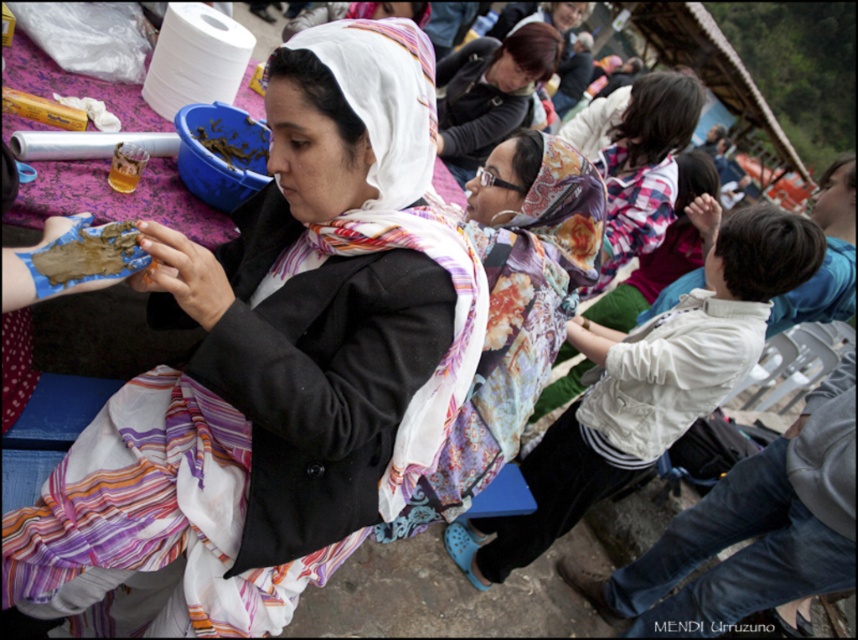
Question: Which object appears closest to the camera in this image?

Choices:
 (A) white fabric headscarf at center
 (B) white printed scarf at center
 (C) brown clay hand at center

Answer: (C)

Question: Is white printed scarf at center positioned in front of matte black jacket at upper center?

Choices:
 (A) yes
 (B) no

Answer: (A)

Question: Does striped silk scarf at center have a greater width compared to brown clay at center?

Choices:
 (A) no
 (B) yes

Answer: (B)

Question: Considering the real-world distances, which object is farthest from the white fabric headscarf at center?

Choices:
 (A) matte black jacket at upper center
 (B) white printed scarf at center
 (C) striped silk scarf at center
 (D) matte black jacket at center

Answer: (A)

Question: Is matte black jacket at upper center to the left of brown clay hand at center from the viewer's perspective?

Choices:
 (A) yes
 (B) no

Answer: (B)

Question: Which object is closer to the camera taking this photo?

Choices:
 (A) striped silk scarf at center
 (B) brown clay hand at center
 (C) matte black jacket at center
 (D) white fabric headscarf at center

Answer: (B)